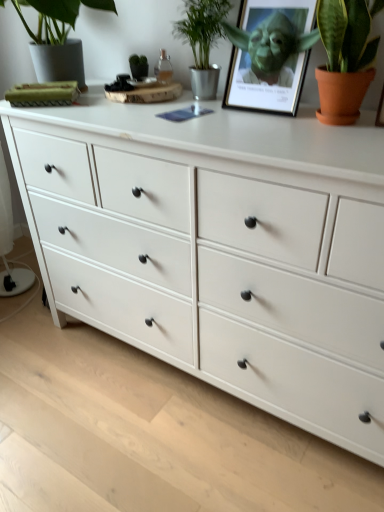
Question: Is green metallic plant at upper center, arranged as the second houseplant when viewed from the right, outside of matte green picture frame at upper center?

Choices:
 (A) yes
 (B) no

Answer: (A)

Question: Would you say matte green picture frame at upper center is part of green metallic plant at upper center, the 2th houseplant positioned from the left,'s contents?

Choices:
 (A) yes
 (B) no

Answer: (B)

Question: Is green metallic plant at upper center, the 2th houseplant positioned from the left, to the left of matte green picture frame at upper center from the viewer's perspective?

Choices:
 (A) no
 (B) yes

Answer: (B)

Question: Is green metallic plant at upper center, arranged as the second houseplant when viewed from the right, wider than matte green picture frame at upper center?

Choices:
 (A) yes
 (B) no

Answer: (A)

Question: Is green metallic plant at upper center, arranged as the second houseplant when viewed from the right, oriented away from matte green picture frame at upper center?

Choices:
 (A) no
 (B) yes

Answer: (A)

Question: Choose the correct answer: Is green metallic plant at upper center, arranged as the second houseplant when viewed from the right, inside green matte plant at upper left, positioned as the third houseplant in right-to-left order, or outside it?

Choices:
 (A) outside
 (B) inside

Answer: (A)

Question: Relative to green matte plant at upper left, the 1th houseplant positioned from the left, is green metallic plant at upper center, the 2th houseplant positioned from the left, in front or behind?

Choices:
 (A) behind
 (B) front

Answer: (A)

Question: From a real-world perspective, is green metallic plant at upper center, the 2th houseplant positioned from the left, positioned above or below green matte plant at upper left, positioned as the third houseplant in right-to-left order?

Choices:
 (A) below
 (B) above

Answer: (A)

Question: Does point (208, 15) appear closer or farther from the camera than point (62, 73)?

Choices:
 (A) farther
 (B) closer

Answer: (B)

Question: Is matte green picture frame at upper center spatially inside green metallic plant at upper center, arranged as the second houseplant when viewed from the right, or outside of it?

Choices:
 (A) inside
 (B) outside

Answer: (B)

Question: From a real-world perspective, relative to green metallic plant at upper center, the 2th houseplant positioned from the left, is matte green picture frame at upper center vertically above or below?

Choices:
 (A) below
 (B) above

Answer: (A)

Question: Is matte green picture frame at upper center bigger or smaller than green metallic plant at upper center, arranged as the second houseplant when viewed from the right?

Choices:
 (A) small
 (B) big

Answer: (B)

Question: Is matte green picture frame at upper center in front of or behind green metallic plant at upper center, arranged as the second houseplant when viewed from the right, in the image?

Choices:
 (A) front
 (B) behind

Answer: (A)

Question: Is matte green picture frame at upper center in front of or behind terracotta clay pot at upper right, acting as the first houseplant starting from the right, in the image?

Choices:
 (A) behind
 (B) front

Answer: (A)

Question: Is point (268, 37) closer or farther from the camera than point (354, 44)?

Choices:
 (A) farther
 (B) closer

Answer: (A)